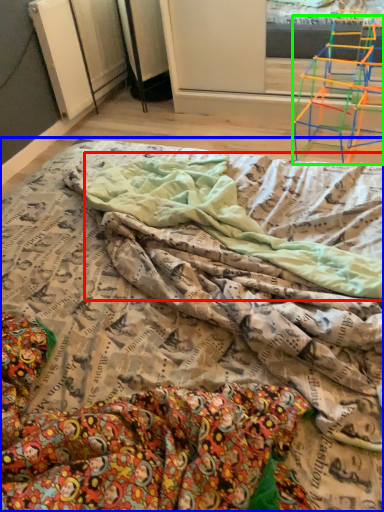
Question: Which object is the farthest from blanket (highlighted by a red box)? Choose among these: bed (highlighted by a blue box) or furniture (highlighted by a green box).

Choices:
 (A) bed
 (B) furniture

Answer: (B)